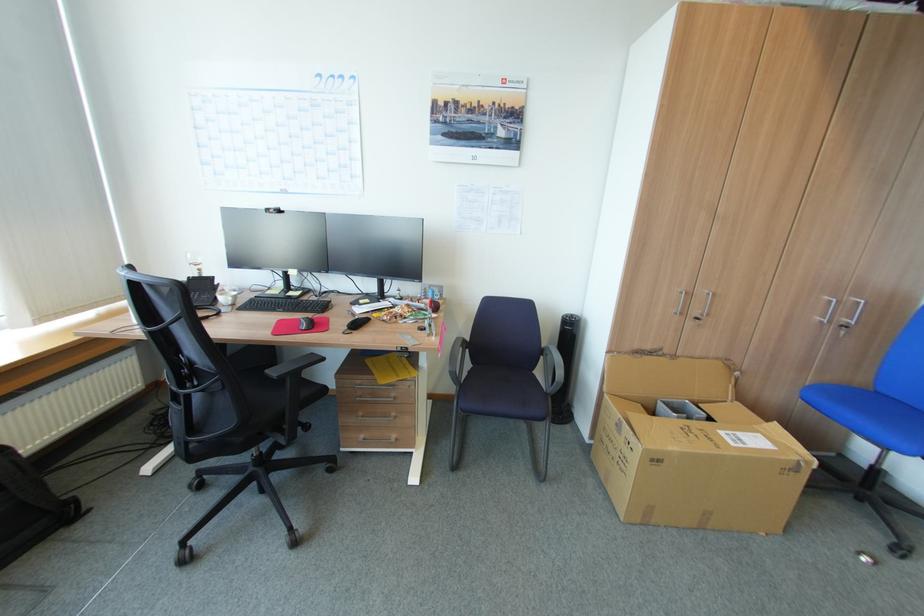
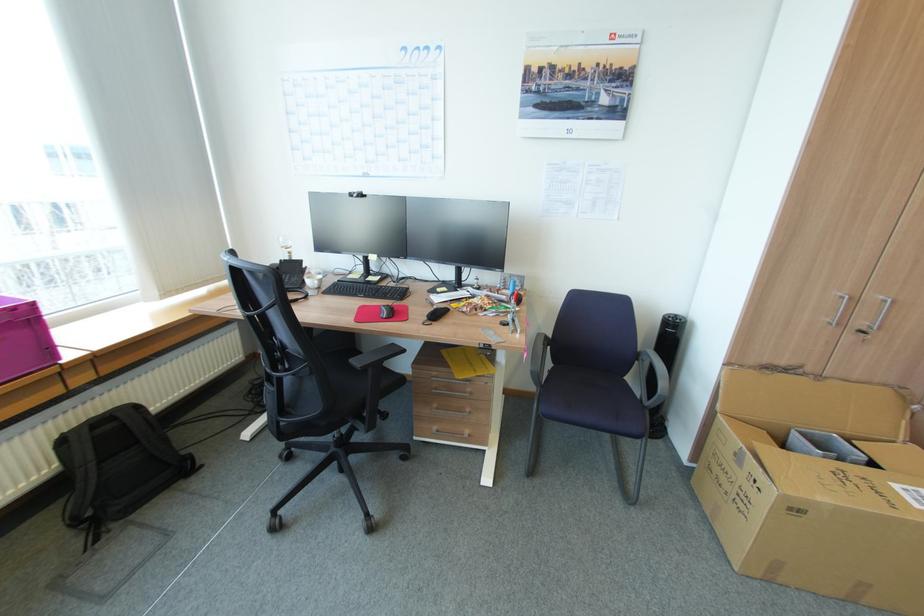
The point at (310, 320) is marked in the first image. Where is the corresponding point in the second image?

(391, 308)